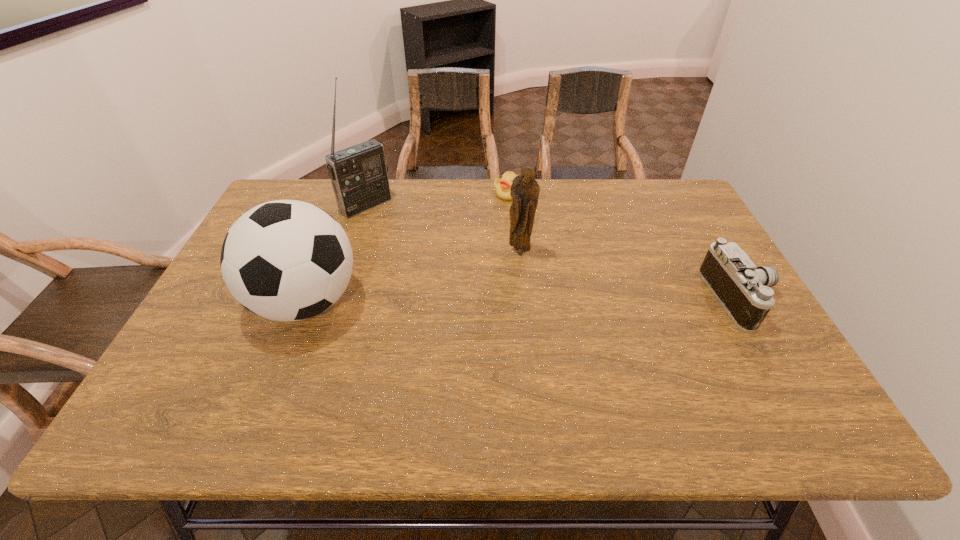
The height and width of the screenshot is (540, 960). What are the coordinates of `free space between the soccer ball and the third farthest object` in the screenshot? It's located at (413, 278).

This screenshot has height=540, width=960. Find the location of `unoccupied position between the soccer ball and the rightmost object`. unoccupied position between the soccer ball and the rightmost object is located at coordinates (523, 300).

Locate an element on the screen. vacant area that lies between the soccer ball and the rightmost object is located at coordinates (523, 300).

Locate an element on the screen. The height and width of the screenshot is (540, 960). vacant area between the tallest object and the duckling is located at coordinates (438, 199).

Find the location of `vacant space that's between the radio receiver and the figurine`. vacant space that's between the radio receiver and the figurine is located at coordinates (444, 229).

Identify which object is the second nearest to the figurine. Please provide its 2D coordinates. Your answer should be formatted as a tuple, i.e. [(x, y)], where the tuple contains the x and y coordinates of a point satisfying the conditions above.

[(285, 260)]

Locate which object is the second closest to the soccer ball. Please provide its 2D coordinates. Your answer should be formatted as a tuple, i.e. [(x, y)], where the tuple contains the x and y coordinates of a point satisfying the conditions above.

[(525, 190)]

I want to click on free spot that satisfies the following two spatial constraints: 1. on the front side of the radio receiver; 2. on the right side of the figurine, so click(350, 253).